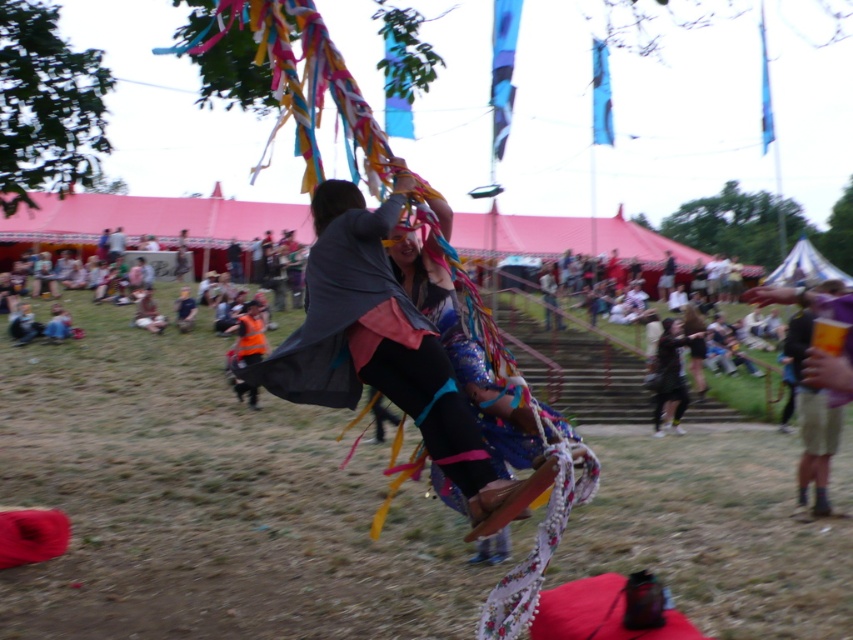
You are a photographer trying to capture the maypole dance scene. You notice the black fabric pants at center and the orange reflective vest at center. Which object should you focus on to ensure it appears larger in your photo?

The black fabric pants at center should be focused on because it is closer to the viewer than the orange reflective vest at center, making it appear larger in the photo.

You are a photographer trying to capture the maypole dance. You want to ensure the shiny metallic cape at center is centered in your shot. Given its position at point coordinates, what adjustments should you make to frame it properly?

The shiny metallic cape at center is located at coordinates point [383,348]. To center it, adjust the camera so the cape aligns with the center point of the frame, which is typically at [426,320]. Move the camera slightly upwards and to the right to compensate for the current position.